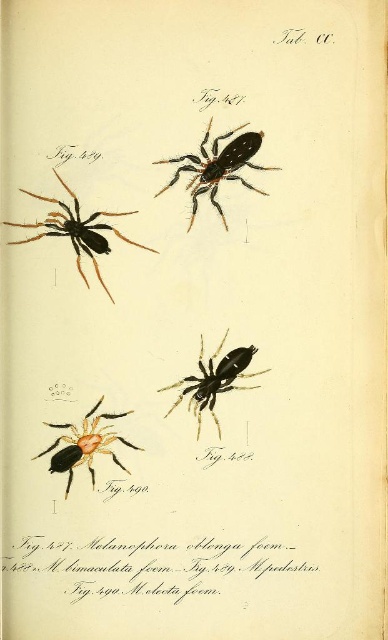
Question: Among these objects, which one is farthest from the camera?

Choices:
 (A) black matte spider at center
 (B) orange matte spider at lower left
 (C) black matte spider at upper center
 (D) matte black spider at upper left

Answer: (A)

Question: In this image, where is black matte spider at upper center located relative to matte black spider at upper left?

Choices:
 (A) left
 (B) right

Answer: (B)

Question: Is matte black spider at upper left positioned behind black matte spider at center?

Choices:
 (A) yes
 (B) no

Answer: (B)

Question: Is black matte spider at upper center positioned in front of orange matte spider at lower left?

Choices:
 (A) yes
 (B) no

Answer: (B)

Question: Estimate the real-world distances between objects in this image. Which object is farther from the matte black spider at upper left?

Choices:
 (A) black matte spider at center
 (B) black matte spider at upper center
 (C) orange matte spider at lower left

Answer: (C)

Question: Which object is the farthest from the orange matte spider at lower left?

Choices:
 (A) black matte spider at center
 (B) matte black spider at upper left

Answer: (B)